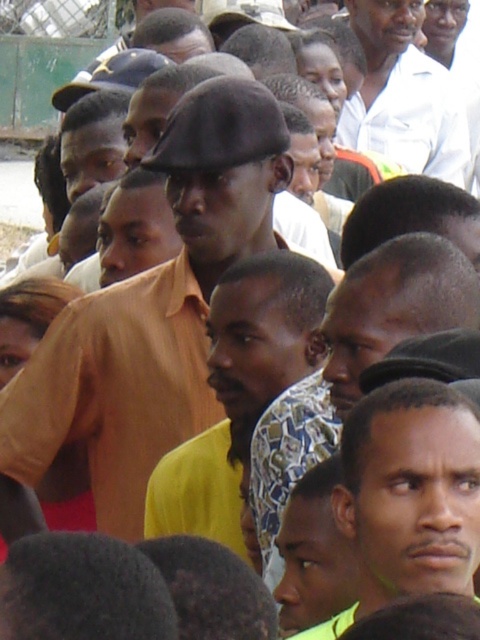
Question: Which of the following is the farthest from the observer?

Choices:
 (A) matte yellow shirt at center
 (B) white shirt at upper center

Answer: (B)

Question: Does matte yellow shirt at center lie in front of white shirt at upper center?

Choices:
 (A) yes
 (B) no

Answer: (A)

Question: Is matte yellow shirt at center positioned behind white shirt at upper center?

Choices:
 (A) yes
 (B) no

Answer: (B)

Question: Observing the image, what is the correct spatial positioning of matte yellow shirt at center in reference to white shirt at upper center?

Choices:
 (A) right
 (B) left

Answer: (B)